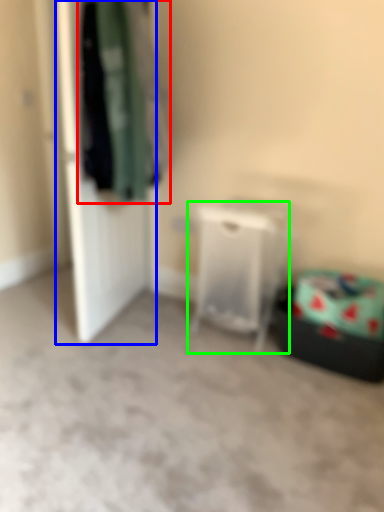
Question: Which is farther away from clothing (highlighted by a red box)? door (highlighted by a blue box) or furniture (highlighted by a green box)?

Choices:
 (A) door
 (B) furniture

Answer: (B)